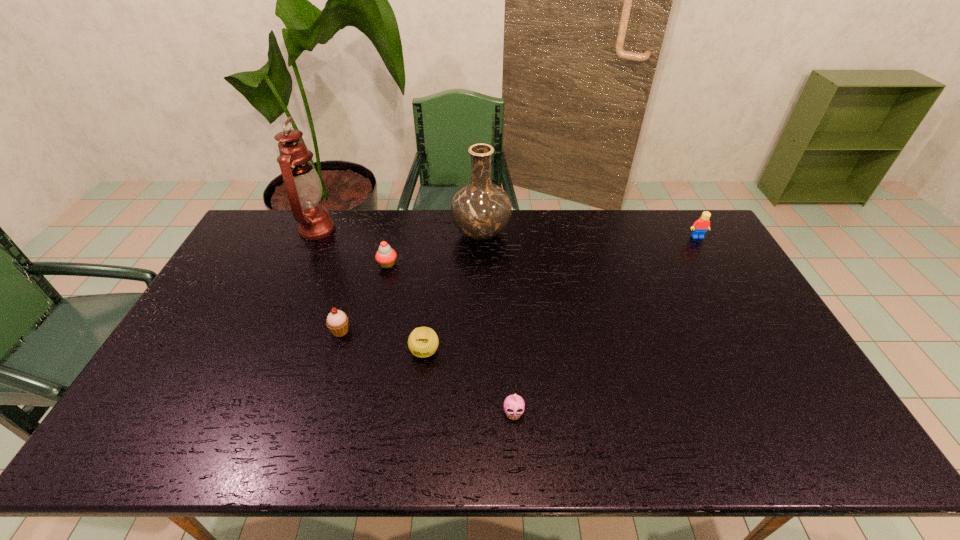
Locate an element on the screen. The image size is (960, 540). the leftmost object is located at coordinates (304, 189).

Where is `oil lamp`? oil lamp is located at coordinates (304, 189).

You are a GUI agent. You are given a task and a screenshot of the screen. Output one action in this format:
    pyautogui.click(x=<x>, y=<y>)
    Task: Click on the vase
    This screenshot has width=960, height=540.
    Given the screenshot: What is the action you would take?
    pyautogui.click(x=481, y=210)

I want to click on the rightmost object, so click(x=700, y=226).

This screenshot has height=540, width=960. Find the location of `the farthest cupcake`. the farthest cupcake is located at coordinates (385, 256).

The height and width of the screenshot is (540, 960). What are the coordinates of `the third object from left to right` in the screenshot? It's located at (385, 256).

Find the location of a particular element. the leftmost cupcake is located at coordinates (337, 321).

The image size is (960, 540). Identify the location of the second farthest cupcake. (337, 321).

At what (x,y) coordinates should I click in order to perform the action: click on the rightmost cupcake. Please return your answer as a coordinate pair (x, y). The image size is (960, 540). Looking at the image, I should click on (515, 404).

The image size is (960, 540). I want to click on the nearest cupcake, so (515, 404).